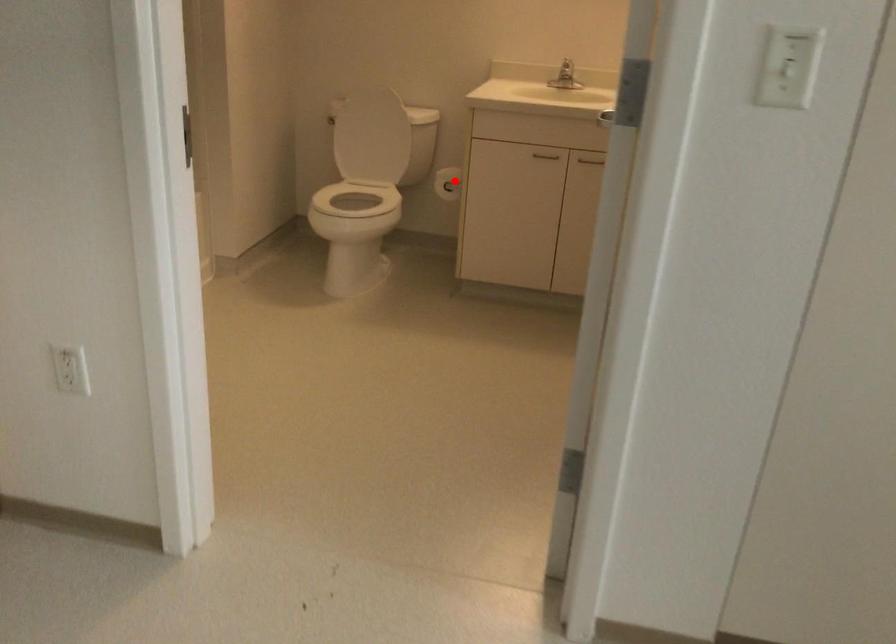
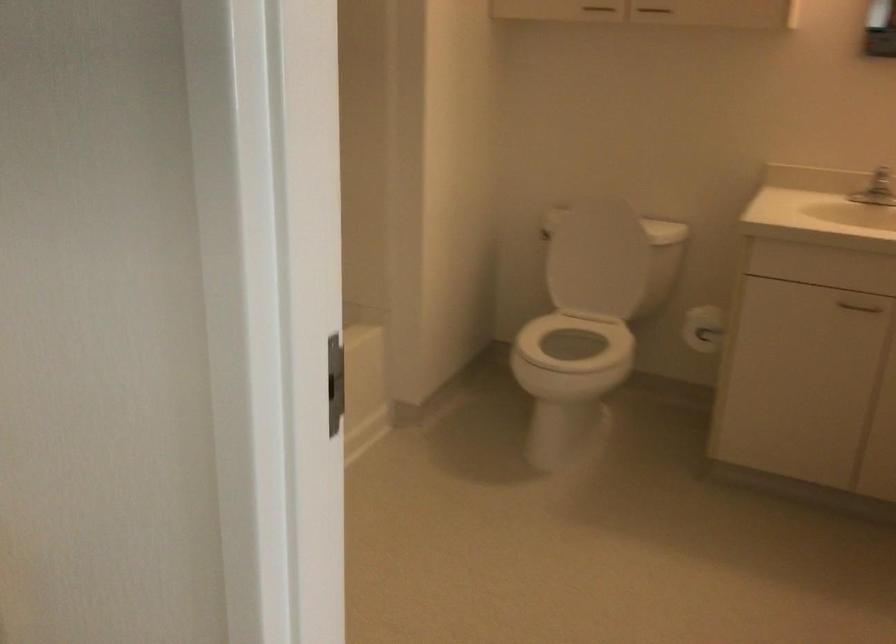
Question: I am providing you with two images of the same scene from different viewpoints. In image1, a red point is highlighted. Considering the same 3D point in image2, which of the following is correct?

Choices:
 (A) It is closer
 (B) It is farther

Answer: (A)